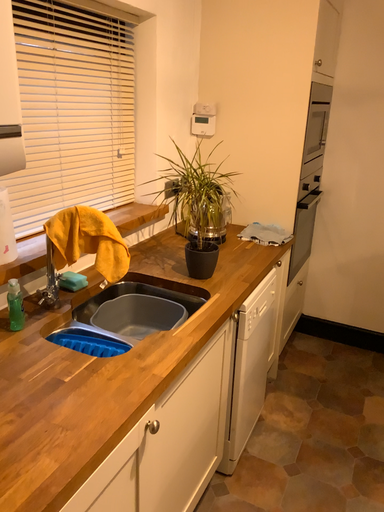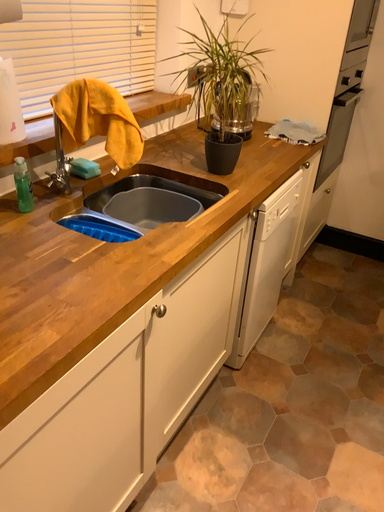
Question: How did the camera likely rotate when shooting the video?

Choices:
 (A) rotated downward
 (B) rotated upward

Answer: (A)